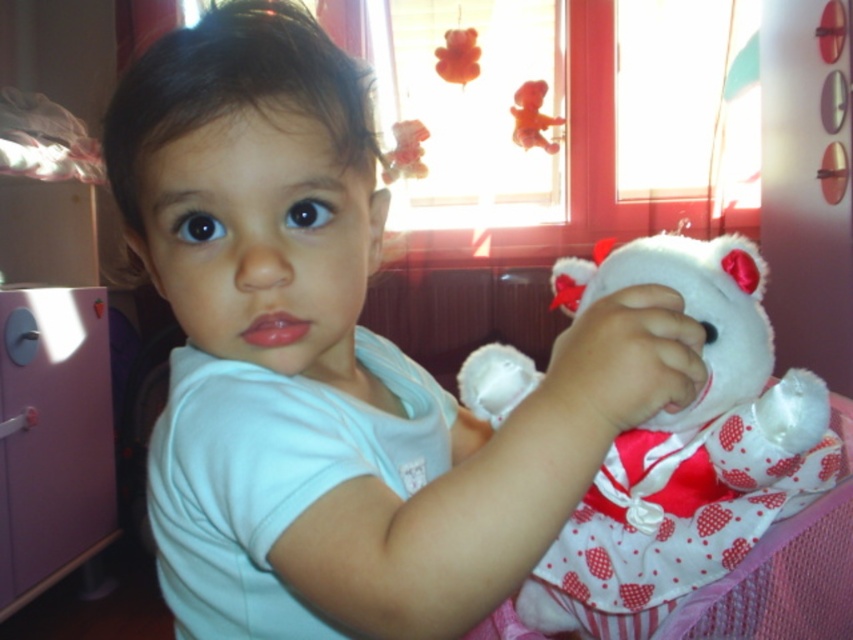
Between point (759, 442) and point (537, 112), which one is positioned behind?

Positioned behind is point (537, 112).

The height and width of the screenshot is (640, 853). What do you see at coordinates (683, 449) in the screenshot?
I see `white soft teddy bear at center` at bounding box center [683, 449].

I want to click on white soft teddy bear at center, so click(683, 449).

Is white soft shirt at center closer to the viewer compared to fuzzy brown teddy bear at upper right?

Yes, white soft shirt at center is closer to the viewer.

Between white soft shirt at center and fuzzy brown teddy bear at upper right, which one is positioned lower?

white soft shirt at center is lower down.

The height and width of the screenshot is (640, 853). What do you see at coordinates (253, 192) in the screenshot?
I see `white soft shirt at center` at bounding box center [253, 192].

Locate an element on the screen. This screenshot has height=640, width=853. white soft shirt at center is located at coordinates (253, 192).

Between point (468, 604) and point (628, 253), which one is positioned in front?

Point (468, 604) is in front.

The height and width of the screenshot is (640, 853). Describe the element at coordinates (253, 192) in the screenshot. I see `white soft shirt at center` at that location.

This screenshot has width=853, height=640. Find the location of `white soft shirt at center`. white soft shirt at center is located at coordinates (253, 192).